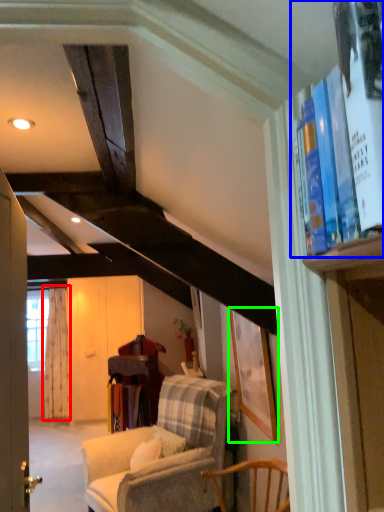
Question: Based on their relative distances, which object is nearer to curtain (highlighted by a red box)? Choose from book (highlighted by a blue box) and picture frame (highlighted by a green box).

Choices:
 (A) book
 (B) picture frame

Answer: (B)